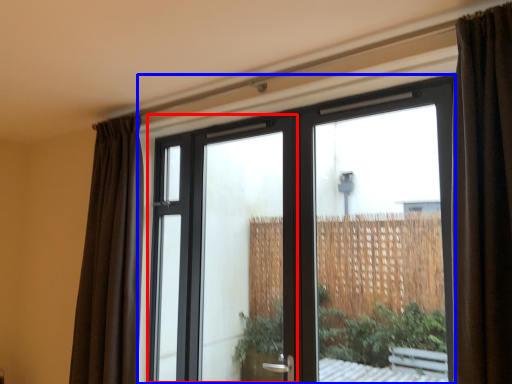
Question: Which point is further to the camera, screen door (highlighted by a red box) or window (highlighted by a blue box)?

Choices:
 (A) screen door
 (B) window

Answer: (A)